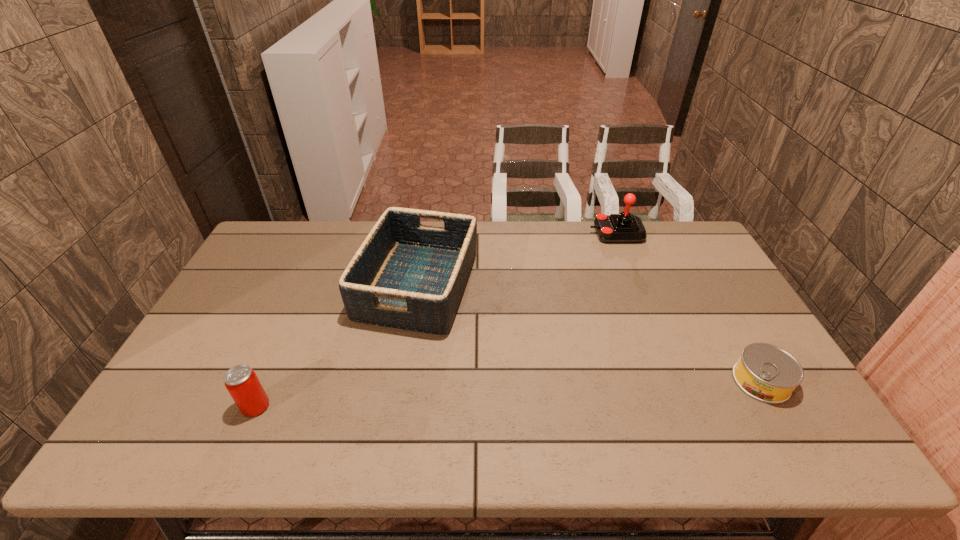
Select which object appears as the second closest to the basket. Please provide its 2D coordinates. Your answer should be formatted as a tuple, i.e. [(x, y)], where the tuple contains the x and y coordinates of a point satisfying the conditions above.

[(615, 228)]

Point out which object is positioned as the third nearest to the taller can. Please provide its 2D coordinates. Your answer should be formatted as a tuple, i.e. [(x, y)], where the tuple contains the x and y coordinates of a point satisfying the conditions above.

[(767, 373)]

Where is `free location that satisfies the following two spatial constraints: 1. on the base of the shortest object; 2. on the right side of the third object from left to right`? The image size is (960, 540). free location that satisfies the following two spatial constraints: 1. on the base of the shortest object; 2. on the right side of the third object from left to right is located at coordinates (675, 381).

Identify the location of vacant region that satisfies the following two spatial constraints: 1. on the back side of the right can; 2. on the base of the second object from right to left. This screenshot has height=540, width=960. (676, 233).

Locate an element on the screen. blank space that satisfies the following two spatial constraints: 1. on the base of the second object from right to left; 2. on the right side of the shortest object is located at coordinates (675, 381).

You are a GUI agent. You are given a task and a screenshot of the screen. Output one action in this format:
    pyautogui.click(x=<x>, y=<y>)
    Task: Click on the free spot that satisfies the following two spatial constraints: 1. on the base of the third object from left to right; 2. on the back side of the shortest object
    The width and height of the screenshot is (960, 540).
    Given the screenshot: What is the action you would take?
    pyautogui.click(x=675, y=381)

Locate an element on the screen. The height and width of the screenshot is (540, 960). blank space that satisfies the following two spatial constraints: 1. on the base of the joystick; 2. on the right side of the right can is located at coordinates (675, 381).

Identify the location of free space in the image that satisfies the following two spatial constraints: 1. on the base of the right can; 2. on the right side of the third object from left to right. (675, 381).